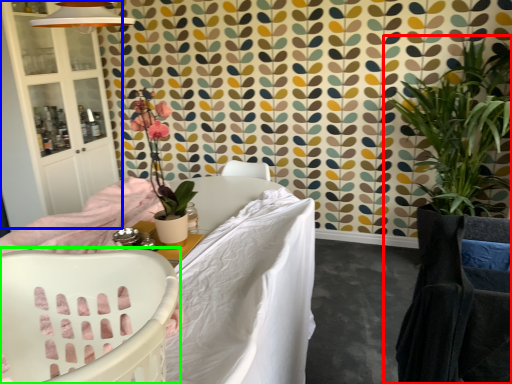
Question: Estimate the real-world distances between objects in this image. Which object is closer to houseplant (highlighted by a red box), armoire (highlighted by a blue box) or chair (highlighted by a green box)?

Choices:
 (A) armoire
 (B) chair

Answer: (B)